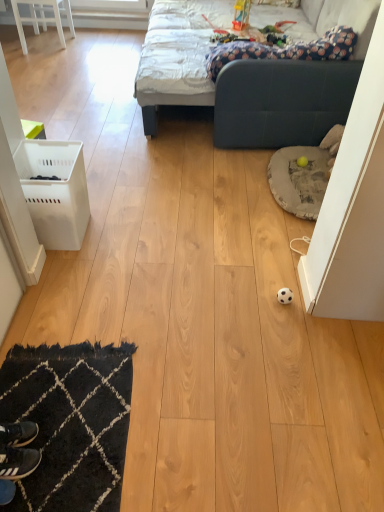
Where is `unoccupied space behind black leather shoe at lower left`? The image size is (384, 512). unoccupied space behind black leather shoe at lower left is located at coordinates (40, 389).